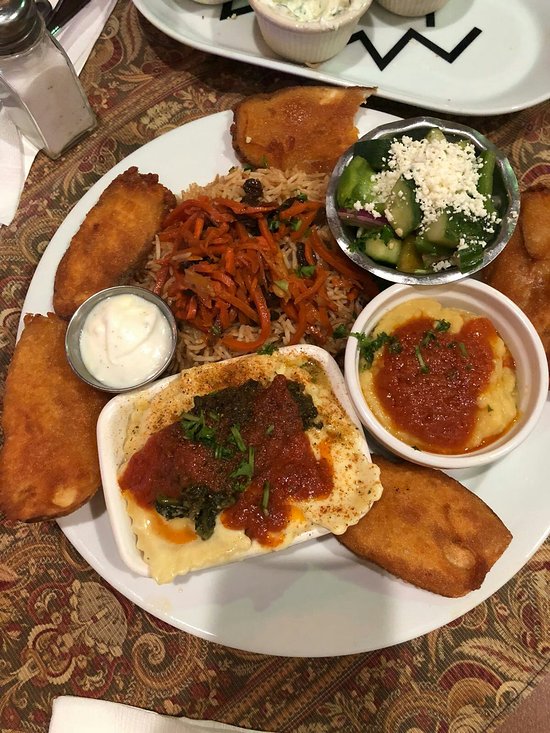
Where is `white plate`? The width and height of the screenshot is (550, 733). white plate is located at coordinates (291, 618).